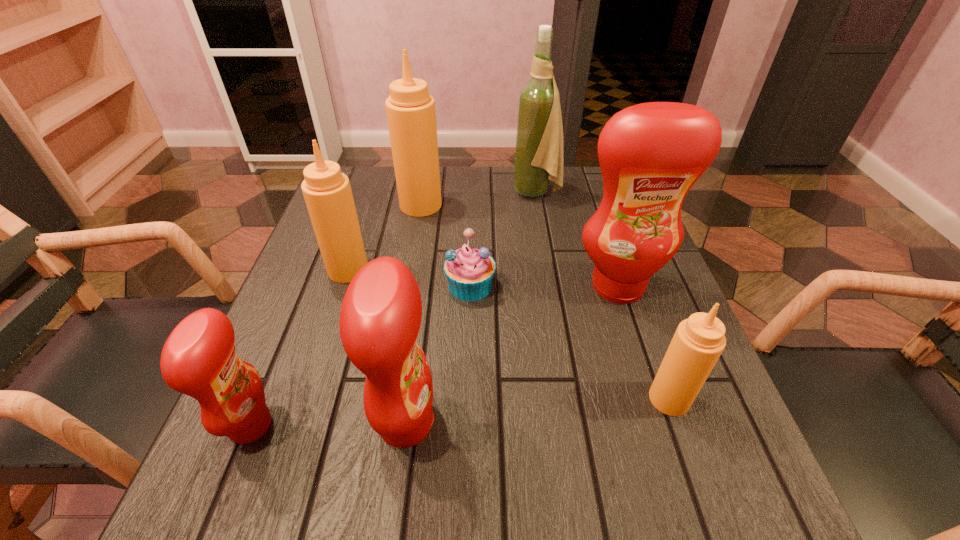
Where is `the smallest tan condiment`? This screenshot has width=960, height=540. the smallest tan condiment is located at coordinates (698, 342).

Find the location of a particular element. This screenshot has height=540, width=960. muffin is located at coordinates (469, 271).

Find the location of a particular element. The height and width of the screenshot is (540, 960). blue muffin is located at coordinates (469, 271).

In order to click on vacant area located on the front-facing side of the wine bottle in this screenshot , I will do `click(487, 192)`.

Identify the location of free space located 0.170m on the front-facing side of the wine bottle. The height and width of the screenshot is (540, 960). (449, 192).

I want to click on vacant point located on the front-facing side of the wine bottle, so click(x=372, y=192).

Identify the location of free space located on the label side of the biggest red condiment. The image size is (960, 540). 652,390.

Find the location of a particular element. free space located 0.190m on the front of the farthest tan condiment is located at coordinates (410, 268).

Identify the location of vacant space positioned on the back of the leftmost tan condiment. 372,198.

Where is `vacant area situated on the label side of the second biggest red condiment`? vacant area situated on the label side of the second biggest red condiment is located at coordinates (671, 423).